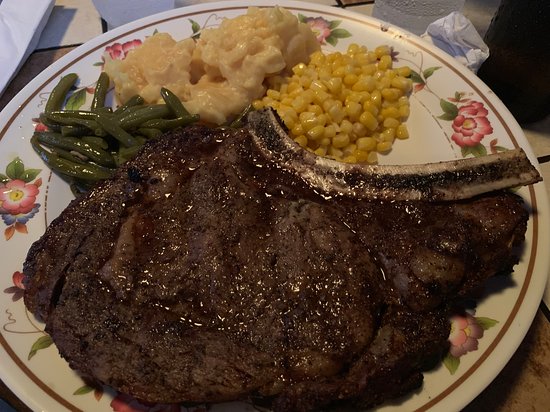
At what (x,y) coordinates should I click in order to perform the action: click on bottle. Please return your answer as a coordinate pair (x, y). The height and width of the screenshot is (412, 550). Looking at the image, I should click on (411, 27).